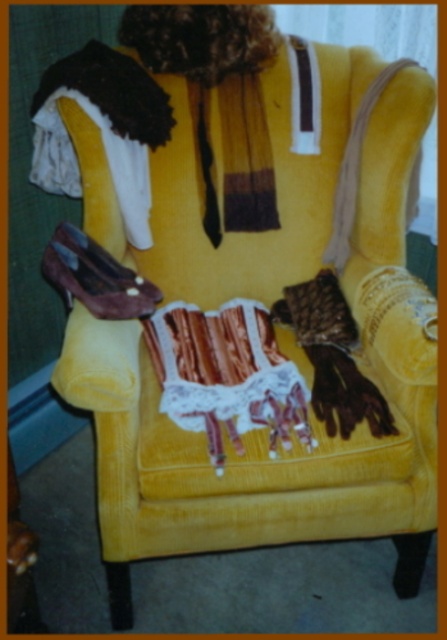
Question: Is brown textured scarf at center thinner than shiny brown leather shoe at lower left?

Choices:
 (A) no
 (B) yes

Answer: (B)

Question: Can you confirm if brown textured scarf at center is positioned above shiny brown leather shoe at lower left?

Choices:
 (A) no
 (B) yes

Answer: (A)

Question: Does brown textured scarf at center appear on the left side of shiny brown leather shoe at lower left?

Choices:
 (A) no
 (B) yes

Answer: (A)

Question: Which point appears closest to the camera in this image?

Choices:
 (A) (92, 294)
 (B) (371, 400)

Answer: (B)